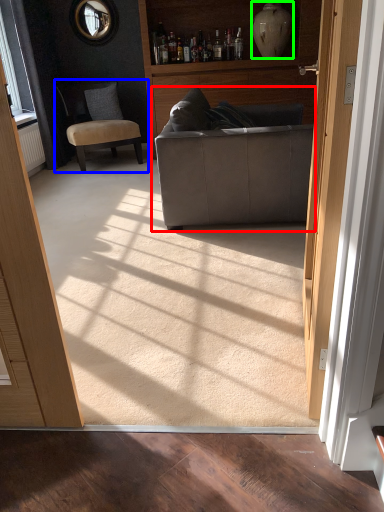
Question: Estimate the real-world distances between objects in this image. Which object is closer to studio couch (highlighted by a red box), chair (highlighted by a blue box) or vase (highlighted by a green box)?

Choices:
 (A) chair
 (B) vase

Answer: (B)